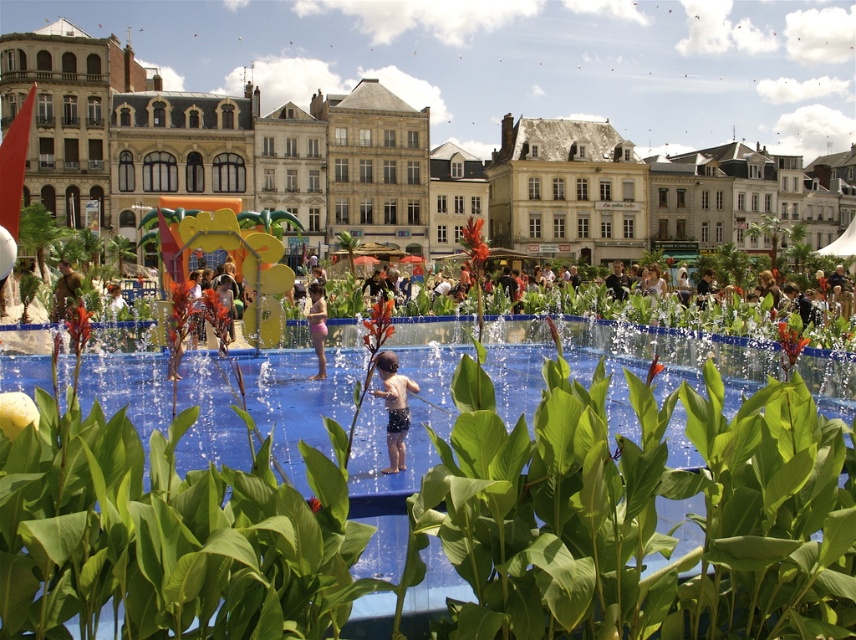
Question: Can you confirm if matte orange playground at center is bigger than pink fabric at center?

Choices:
 (A) yes
 (B) no

Answer: (A)

Question: Which point appears farthest from the camera in this image?

Choices:
 (A) click(x=72, y=275)
 (B) click(x=324, y=317)
 (C) click(x=384, y=364)
 (D) click(x=39, y=13)

Answer: (D)

Question: Can you confirm if blue rubber pool at center is positioned to the right of pink fabric at center?

Choices:
 (A) no
 (B) yes

Answer: (B)

Question: Is blue swim trunks at center to the left of camouflage fabric person at center from the viewer's perspective?

Choices:
 (A) no
 (B) yes

Answer: (A)

Question: Among these points, which one is nearest to the camera?

Choices:
 (A) (321, 321)
 (B) (450, 115)

Answer: (A)

Question: Which is nearer to the pink fabric at center?

Choices:
 (A) matte orange playground at center
 (B) camouflage fabric person at center
 (C) blue rubber pool at center

Answer: (C)